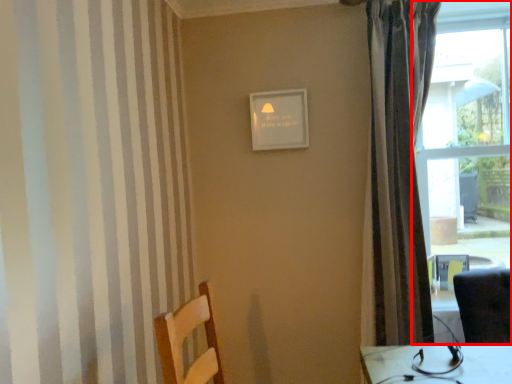
Question: From the image's perspective, considering the relative positions of window (annotated by the red box) and curtain in the image provided, where is window (annotated by the red box) located with respect to the staircase?

Choices:
 (A) above
 (B) below

Answer: (A)